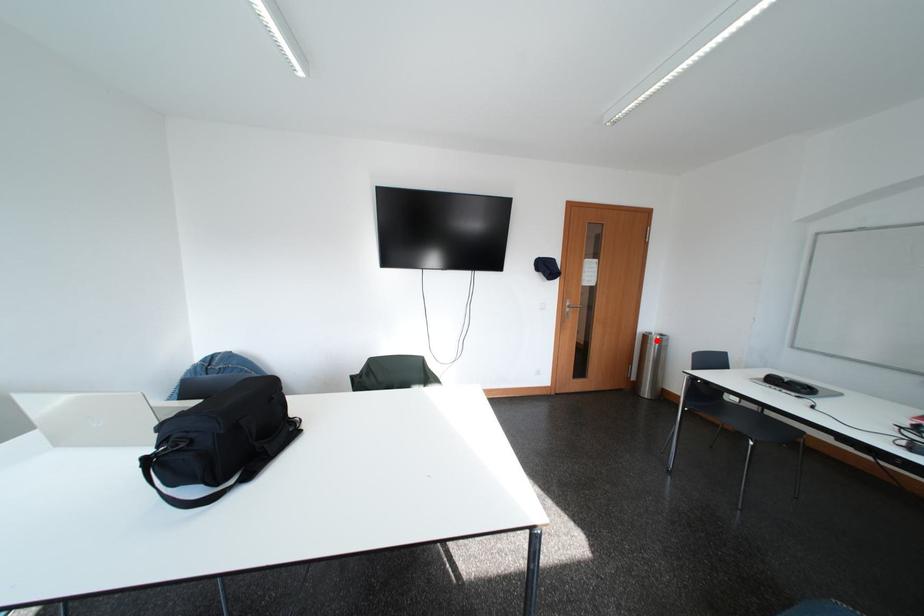
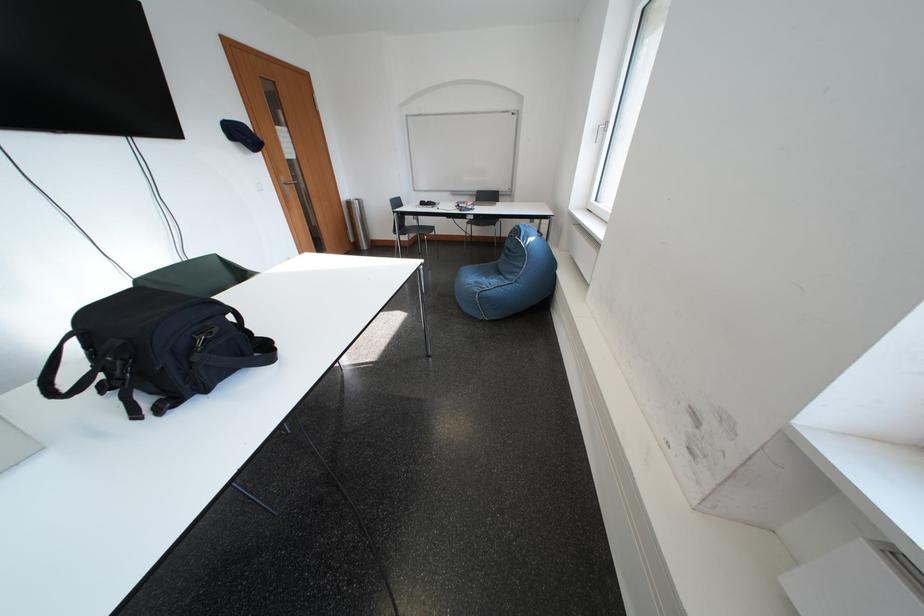
The point at the highlighted location is marked in the first image. Where is the corresponding point in the second image?

(360, 207)